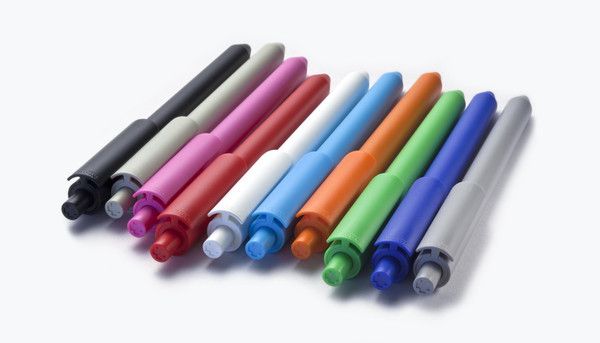
Where is `pens`? pens is located at coordinates (86, 172), (118, 197), (144, 197), (175, 219), (232, 207), (265, 220), (327, 202), (363, 230), (391, 240), (438, 276).